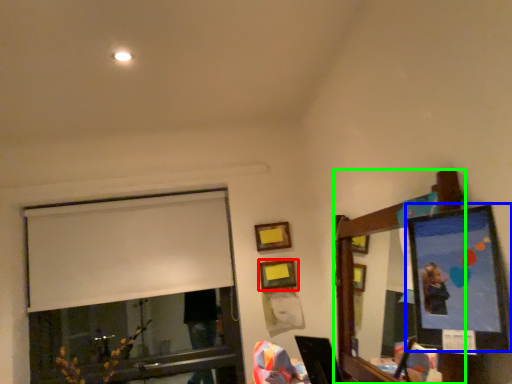
Question: Which object is positioned closest to picture frame (highlighted by a red box)? Select from picture frame (highlighted by a blue box) and mirror (highlighted by a green box).

Choices:
 (A) picture frame
 (B) mirror

Answer: (B)